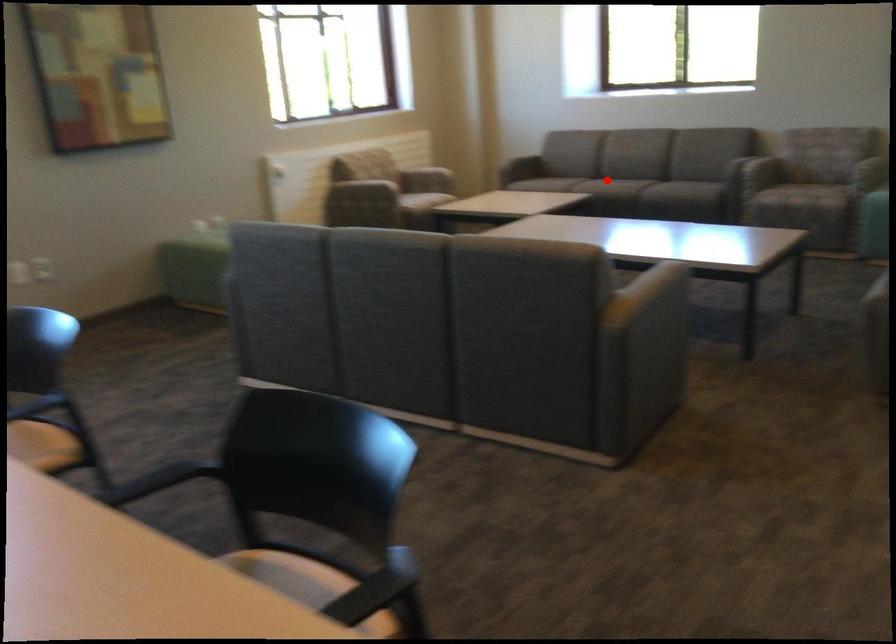
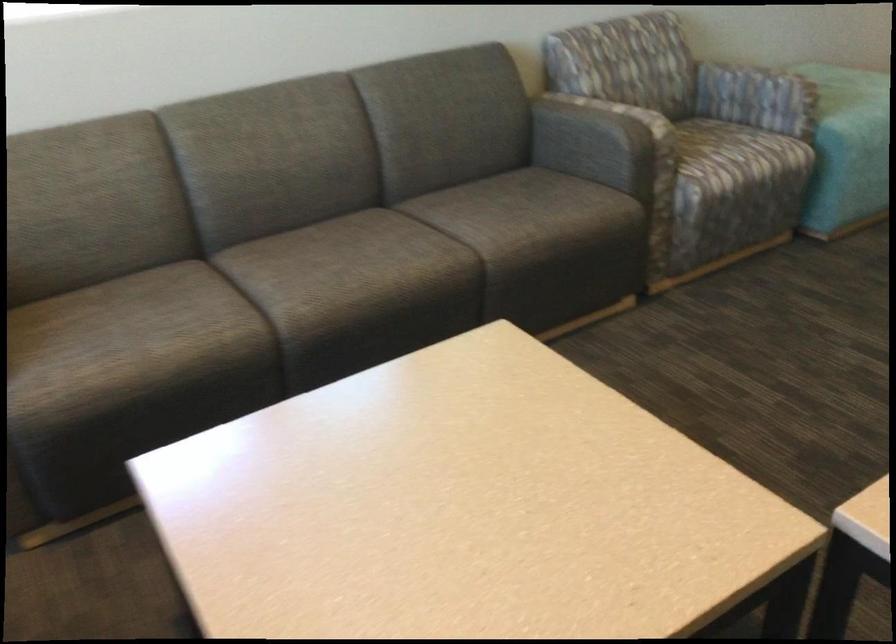
Question: I am providing you with two images of the same scene from different viewpoints. In image1, a red point is highlighted. Considering the same 3D point in image2, which of the following is correct?

Choices:
 (A) It is closer
 (B) It is farther

Answer: (A)